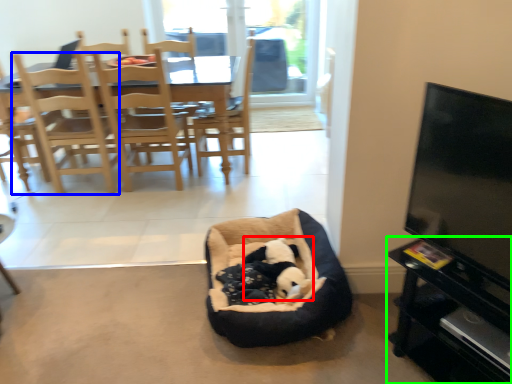
Question: Considering the real-world distances, which object is farthest from animal (highlighted by a red box)? chair (highlighted by a blue box) or entertainment center (highlighted by a green box)?

Choices:
 (A) chair
 (B) entertainment center

Answer: (A)